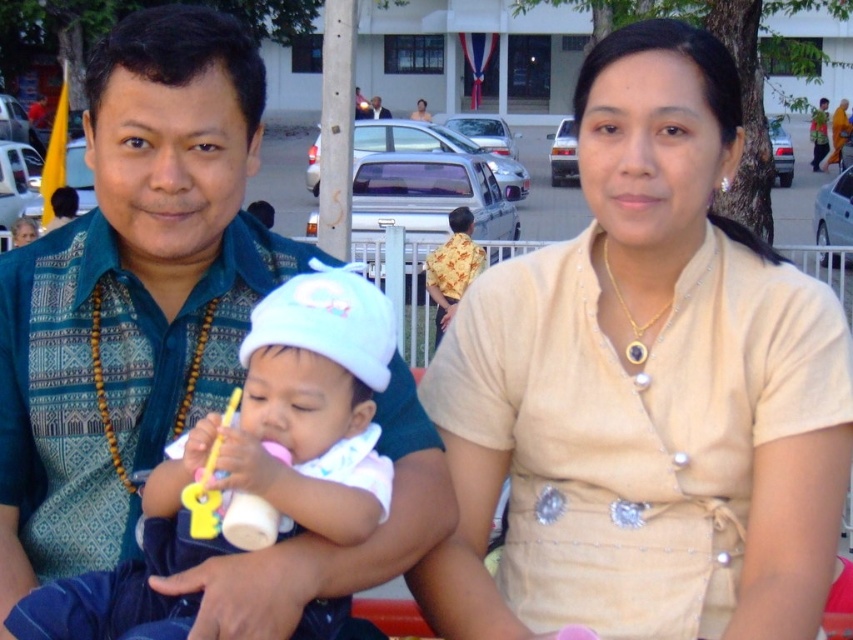
You are a photographer setting up for a family photo. You need to position the beige fabric blouse at center and the blue patterned shirt at left so that they are exactly 4 feet apart. Currently, they are 3.62 feet apart. What adjustment should you make?

The beige fabric blouse at center is currently 3.62 feet from the blue patterned shirt at left, which is 0.38 feet shorter than the desired 4 feet. To achieve the required distance, move the beige fabric blouse at center further away from the blue patterned shirt at left by approximately 0.38 feet.

You are a photographer setting up a shot of the beige fabric blouse at center and the yellow plastic toy at center. To ensure both are in focus, you need to know which object is taller. Which one is taller?

The beige fabric blouse at center is taller than the yellow plastic toy at center according to the description.

You are a photographer setting up for a family photo. You need to ensure that the beige fabric blouse at center and the blue patterned shirt at left are both visible in the frame. Based on their positions, which one is lower in the image?

The beige fabric blouse at center is positioned under the blue patterned shirt at left, so it is lower in the image.